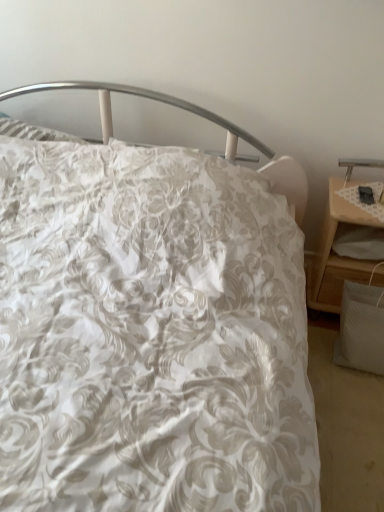
Question: Does point (369, 161) appear closer or farther from the camera than point (319, 308)?

Choices:
 (A) farther
 (B) closer

Answer: (B)

Question: Based on their sizes in the image, would you say metallic silver table lamp at right is bigger or smaller than wooden nightstand at right?

Choices:
 (A) big
 (B) small

Answer: (B)

Question: Is metallic silver table lamp at right taller or shorter than wooden nightstand at right?

Choices:
 (A) short
 (B) tall

Answer: (A)

Question: From a real-world perspective, relative to metallic silver table lamp at right, is wooden nightstand at right vertically above or below?

Choices:
 (A) above
 (B) below

Answer: (B)

Question: Is wooden nightstand at right to the left or to the right of metallic silver table lamp at right in the image?

Choices:
 (A) right
 (B) left

Answer: (B)

Question: From their relative heights in the image, would you say wooden nightstand at right is taller or shorter than metallic silver table lamp at right?

Choices:
 (A) short
 (B) tall

Answer: (B)

Question: Relative to metallic silver table lamp at right, is wooden nightstand at right in front or behind?

Choices:
 (A) front
 (B) behind

Answer: (A)